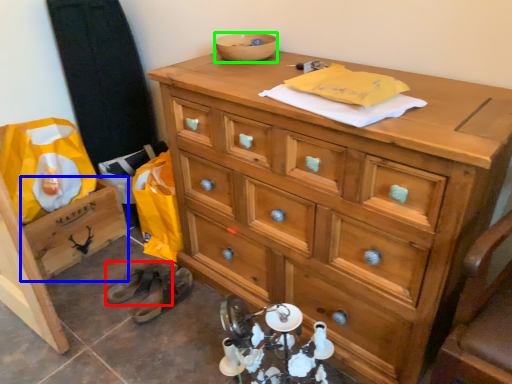
Question: Considering the real-world distances, which object is farthest from shoe (highlighted by a red box)? cabinetry (highlighted by a blue box) or bowl (highlighted by a green box)?

Choices:
 (A) cabinetry
 (B) bowl

Answer: (B)